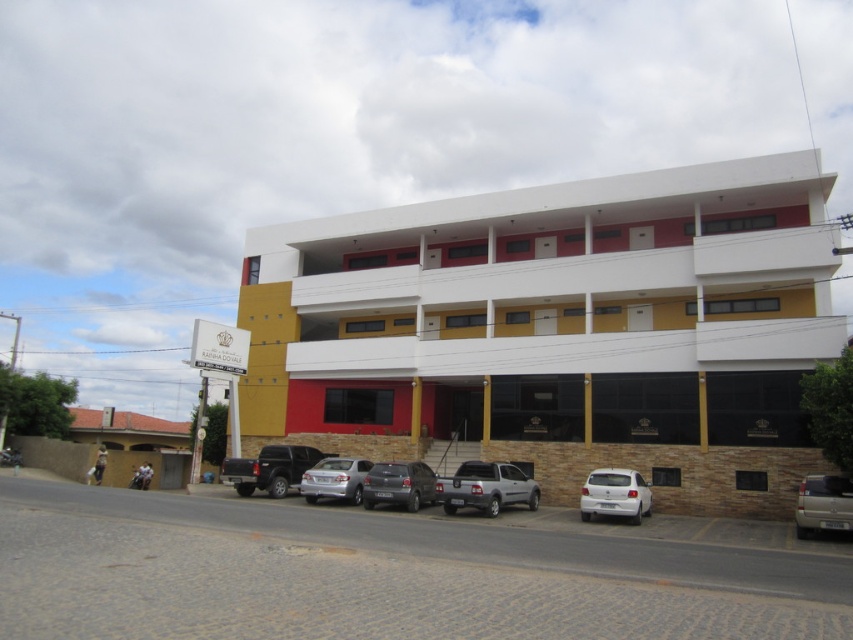
You are a delivery driver who needs to park your vehicle between the matte black truck at center and the white matte hatchback at lower right. Is there enough space between them for your van which is 5 meters long?

The matte black truck at center is to the left of the white matte hatchback at lower right. However, the distance between them isn not specified in the objects description, so it is impossible to determine if there is enough space for a 5 meter van.

You are a delivery person who needs to park your 12.5 feet long truck between the white matte hatchback at lower right and the gold metallic van at lower right. Can you fit your truck in that space?

The white matte hatchback at lower right and gold metallic van at lower right are 15.00 feet apart from each other. Since your truck is 12.5 feet long, it can fit in the space between them as there is enough room.

You are a delivery person standing in front of the building and need to park your vehicle between the matte black truck at center and the white matte hatchback at lower right. Can you fit your delivery van, which is 2 meters wide, in the space between them?

The matte black truck at center is further to the viewer than the white matte hatchback at lower right, so the space between them might be sufficient. However, without knowing the exact distance between the two vehicles, it is impossible to determine if the 2 meter wide delivery van can fit.